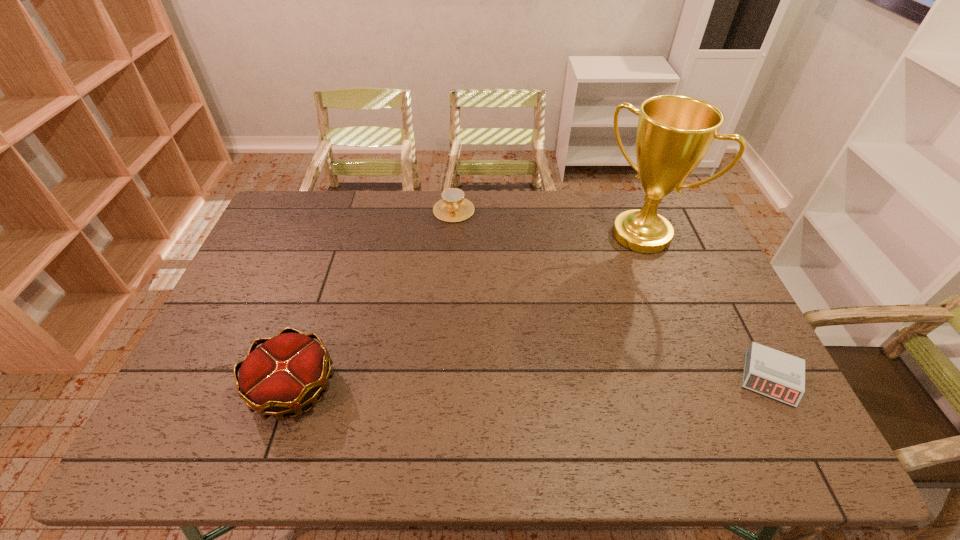
The image size is (960, 540). I want to click on vacant point located 0.330m by the handles of the tallest object, so click(x=572, y=314).

At what (x,y) coordinates should I click in order to perform the action: click on free space located with the handle on the side of the cup. Please return your answer as a coordinate pair (x, y). This screenshot has width=960, height=540. Looking at the image, I should click on (485, 306).

The image size is (960, 540). I want to click on free space located 0.150m with the handle on the side of the cup, so click(x=467, y=251).

The height and width of the screenshot is (540, 960). Identify the location of vacant point located 0.380m with the handle on the side of the cup. (483, 301).

What are the coordinates of `award situated at the far edge` in the screenshot? It's located at (674, 133).

What are the coordinates of `cup that is positioned at the far edge` in the screenshot? It's located at (453, 207).

I want to click on crown located at the near edge, so click(x=288, y=371).

What are the coordinates of `alarm clock that is positioned at the near edge` in the screenshot? It's located at (778, 375).

Locate an element on the screen. alarm clock that is at the right edge is located at coordinates pyautogui.click(x=778, y=375).

Where is `award situated at the right edge`? The image size is (960, 540). award situated at the right edge is located at coordinates (674, 133).